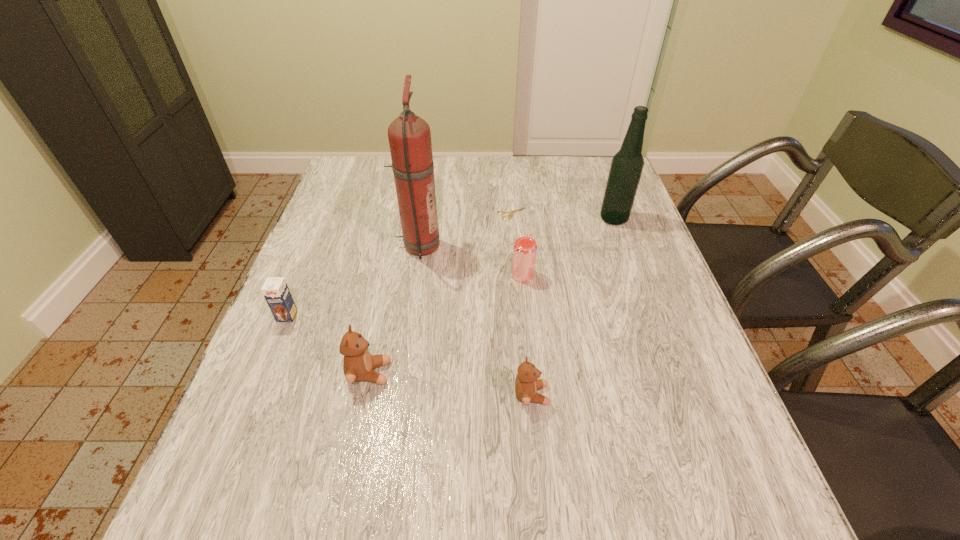
Please show where to add a teddy bear on the right while keeping spacing even. Please provide its 2D coordinates. Your answer should be formatted as a tuple, i.e. [(x, y)], where the tuple contains the x and y coordinates of a point satisfying the conditions above.

[(708, 418)]